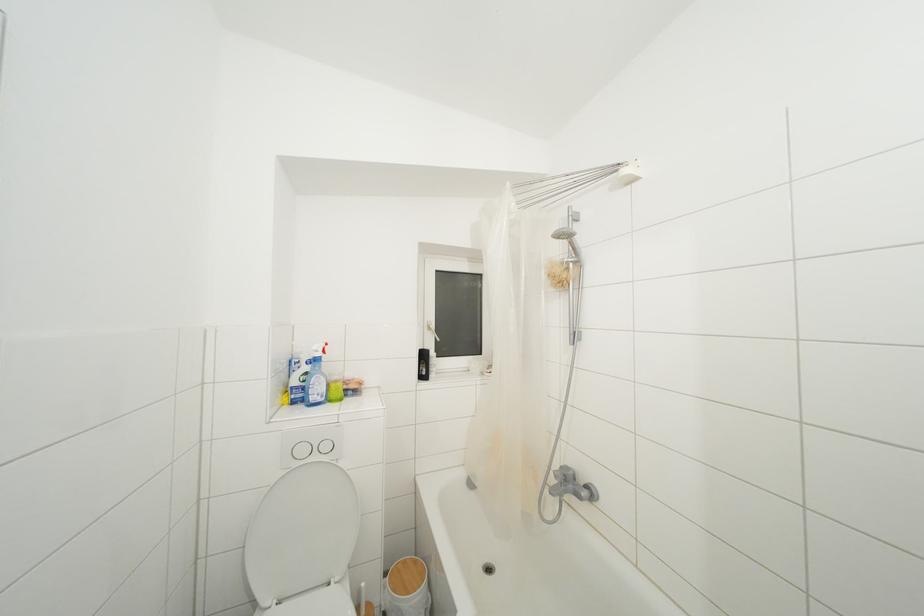
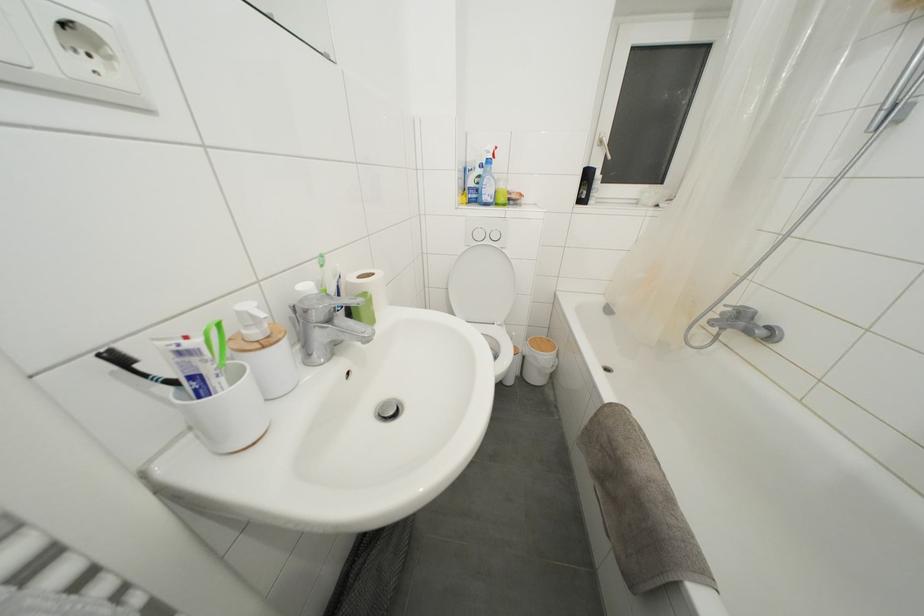
Find the pixel in the second image that matches point 428,361 in the first image.

(591, 180)